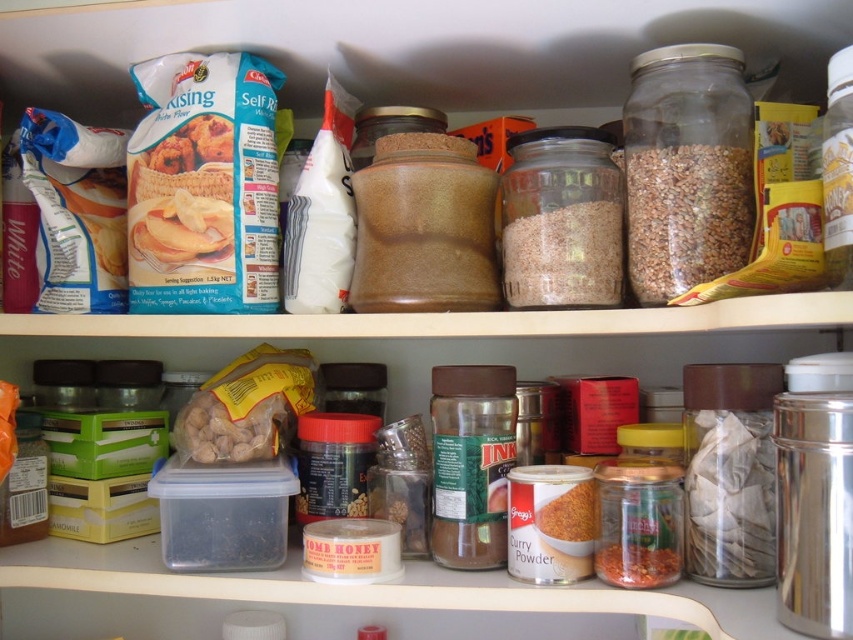
You are organizing the pantry and need to stack items vertically. The brown matte grain at upper right and the translucent glass jar at center are both candidates for stacking. Considering their heights, which one should be placed at the bottom to ensure stability?

The brown matte grain at upper right should be placed at the bottom because it has a greater height than the translucent glass jar at center, providing a stable base for stacking.

You are organizing a pantry and need to place a new item on the top shelf. The pantry has a coordinate system where the bottom left corner is the origin point. The new item must be placed at coordinates between 0.3 and 0.8 on both the x and y axes. Is the brown matte grain at upper right currently occupying a spot within the required coordinates?

The brown matte grain at upper right is located at point [685,216]. Since both coordinates fall within the range of 0.3 to 0.8, the spot is already occupied by the brown matte grain at upper right.